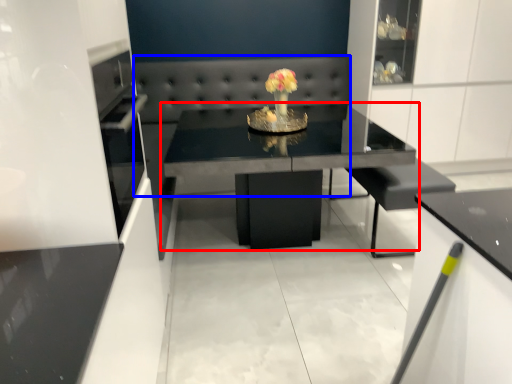
Question: Which of the following is the closest to the observer, table (highlighted by a red box) or couch (highlighted by a blue box)?

Choices:
 (A) table
 (B) couch

Answer: (A)